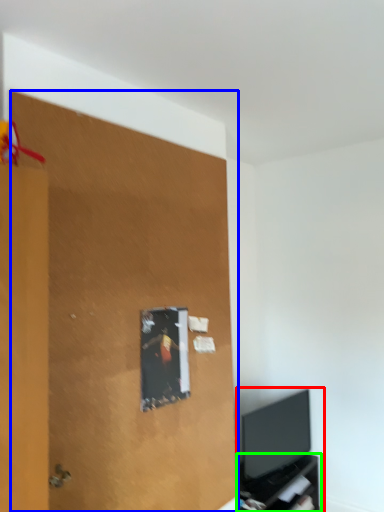
Question: Which object is positioned closest to entertainment center (highlighted by a red box)? Select from plywood (highlighted by a blue box) and tv cabinet (highlighted by a green box).

Choices:
 (A) plywood
 (B) tv cabinet

Answer: (B)